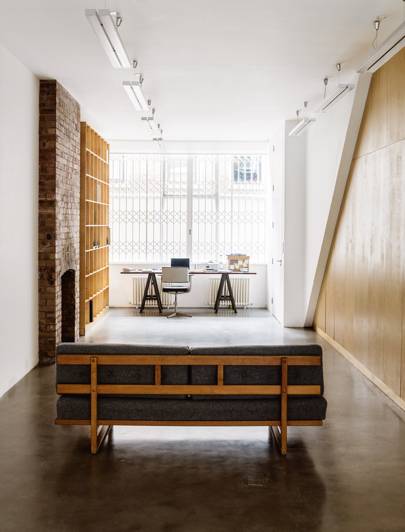
I want to click on brown brick wall, so (x=66, y=259).